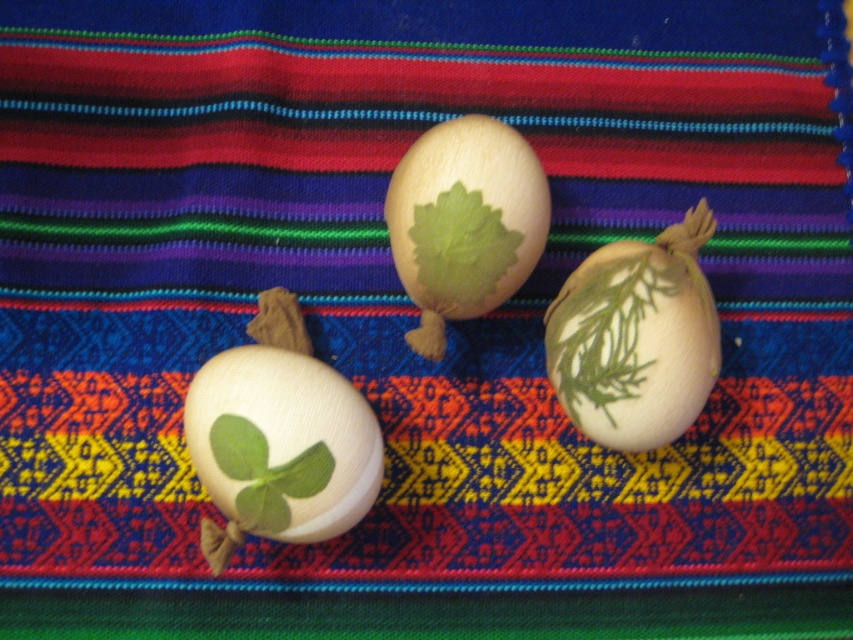
Who is positioned more to the right, wooden egg with green leaf at center or wooden egg with leaf design at center?

wooden egg with leaf design at center

The image size is (853, 640). In order to click on wooden egg with green leaf at center in this screenshot , I will do `click(282, 444)`.

Who is more forward, [347,404] or [422,305]?

Positioned in front is point [347,404].

Find the location of a particular element. This screenshot has width=853, height=640. wooden egg with green leaf at center is located at coordinates (282, 444).

Based on the photo, is the position of wooden egg with green leaf at center less distant than that of green matte onion at center?

Yes, wooden egg with green leaf at center is in front of green matte onion at center.

Describe the element at coordinates (282, 444) in the screenshot. This screenshot has width=853, height=640. I see `wooden egg with green leaf at center` at that location.

Find the location of a particular element. wooden egg with green leaf at center is located at coordinates (282, 444).

This screenshot has width=853, height=640. Identify the location of wooden egg with green leaf at center. (x=282, y=444).

Can you confirm if green matte onion at center is positioned above wooden egg with leaf design at center?

Actually, green matte onion at center is below wooden egg with leaf design at center.

Who is positioned more to the right, green matte onion at center or wooden egg with leaf design at center?

green matte onion at center

Which is in front, point (676, 291) or point (520, 145)?

Positioned in front is point (676, 291).

Find the location of a particular element. Image resolution: width=853 pixels, height=640 pixels. green matte onion at center is located at coordinates (633, 344).